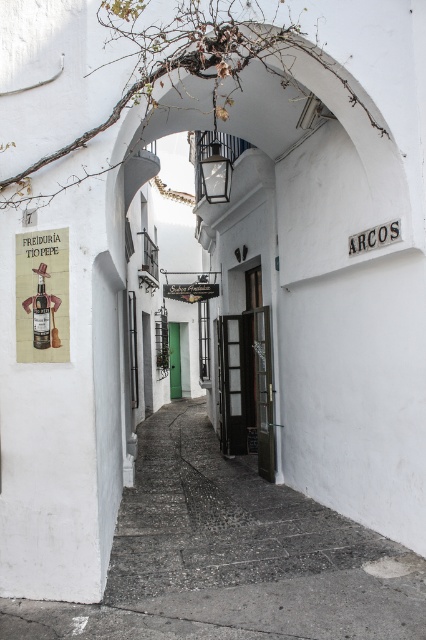
Which is more to the left, matte paper poster at left or matte glass bottle at left?

From the viewer's perspective, matte glass bottle at left appears more on the left side.

Between point (22, 291) and point (40, 285), which one is positioned in front?

Positioned in front is point (40, 285).

You are a GUI agent. You are given a task and a screenshot of the screen. Output one action in this format:
    pyautogui.click(x=<x>, y=<y>)
    Task: Click on the matte paper poster at left
    The height and width of the screenshot is (640, 426).
    Given the screenshot: What is the action you would take?
    pyautogui.click(x=42, y=296)